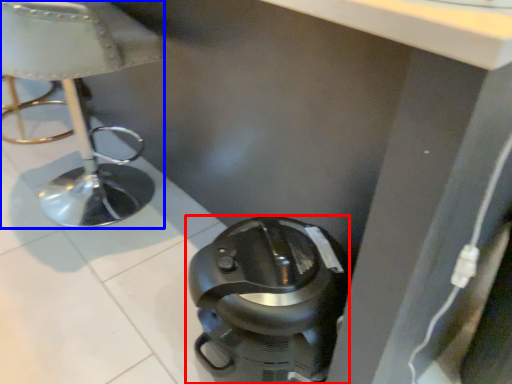
Question: Which point is further to the camera, home appliance (highlighted by a red box) or furniture (highlighted by a blue box)?

Choices:
 (A) home appliance
 (B) furniture

Answer: (B)